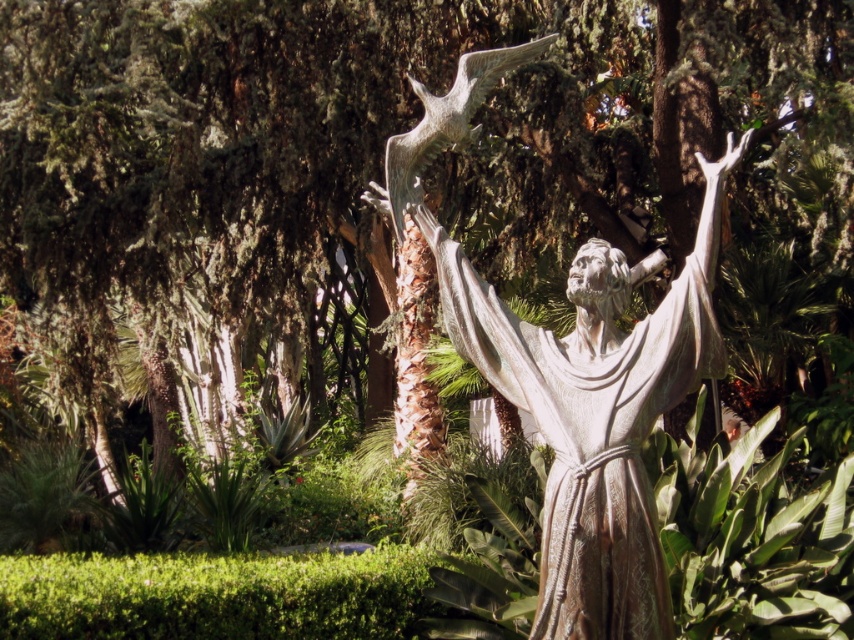
Is bronze statue at center to the right of shiny silver bird at upper center from the viewer's perspective?

Indeed, bronze statue at center is positioned on the right side of shiny silver bird at upper center.

Which is above, bronze statue at center or shiny silver bird at upper center?

shiny silver bird at upper center is higher up.

Who is more distant from viewer, (x=580, y=264) or (x=408, y=204)?

Point (x=408, y=204)

This screenshot has height=640, width=854. I want to click on bronze statue at center, so click(595, 413).